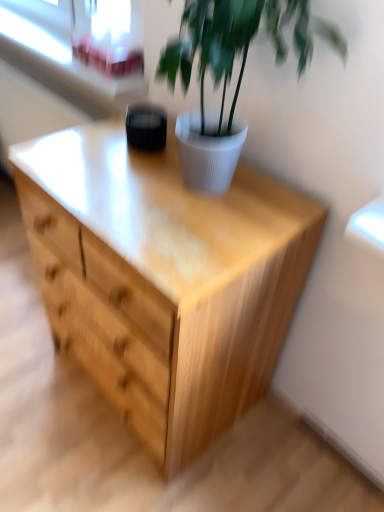
At what (x,y) coordinates should I click in order to perform the action: click on white plastic window frame at upper left. Please return your answer as a coordinate pair (x, y). This screenshot has width=384, height=512. Looking at the image, I should click on (81, 42).

Would you say white plastic window frame at upper left is inside or outside white ribbed pot at upper center?

white plastic window frame at upper left is outside white ribbed pot at upper center.

Considering their positions, is white plastic window frame at upper left located in front of or behind white ribbed pot at upper center?

Clearly, white plastic window frame at upper left is behind white ribbed pot at upper center.

Who is smaller, white plastic window frame at upper left or white ribbed pot at upper center?

Answer: Smaller between the two is white plastic window frame at upper left.

Does point (112, 4) come farther from viewer compared to point (254, 36)?

Yes.

Looking at this image, which is farther, (62, 33) or (98, 222)?

Point (62, 33)

Is white plastic window frame at upper left oriented away from natural wood chest of drawers at center?

No, natural wood chest of drawers at center is not at the back of white plastic window frame at upper left.

Which of these two, white plastic window frame at upper left or natural wood chest of drawers at center, stands taller?

With more height is natural wood chest of drawers at center.

Is white plastic window frame at upper left positioned behind natural wood chest of drawers at center?

Yes, white plastic window frame at upper left is further from the viewer.

Which object is further away from the camera, white ribbed pot at upper center or white plastic window frame at upper left?

white plastic window frame at upper left is further away from the camera.

Locate an element on the screen. The image size is (384, 512). houseplant that appears below the white plastic window frame at upper left (from the image's perspective) is located at coordinates (232, 66).

From a real-world perspective, is white ribbed pot at upper center physically located above or below white plastic window frame at upper left?

In terms of real-world spatial position, white ribbed pot at upper center is above white plastic window frame at upper left.

Considering the relative sizes of white ribbed pot at upper center and white plastic window frame at upper left in the image provided, is white ribbed pot at upper center bigger than white plastic window frame at upper left?

Yes.

Based on the photo, how many degrees apart are the facing directions of natural wood chest of drawers at center and transparent glass window screen at upper left?

The angular difference between natural wood chest of drawers at center and transparent glass window screen at upper left is 0.98 degrees.

How far apart are natural wood chest of drawers at center and transparent glass window screen at upper left?

A distance of 66.13 centimeters exists between natural wood chest of drawers at center and transparent glass window screen at upper left.

From the image's perspective, is natural wood chest of drawers at center positioned above or below transparent glass window screen at upper left?

Clearly, from the image's perspective, natural wood chest of drawers at center is below transparent glass window screen at upper left.

Is natural wood chest of drawers at center far from transparent glass window screen at upper left?

Actually, natural wood chest of drawers at center and transparent glass window screen at upper left are a little close together.

From the picture: Is the surface of white ribbed pot at upper center in direct contact with transparent glass window screen at upper left?

No.

From a real-world perspective, relative to transparent glass window screen at upper left, is white ribbed pot at upper center vertically above or below?

Clearly, from a real-world perspective, white ribbed pot at upper center is above transparent glass window screen at upper left.

Between point (200, 84) and point (137, 69), which one is positioned behind?

The point (137, 69) is farther from the camera.

From their relative heights in the image, would you say white ribbed pot at upper center is taller or shorter than transparent glass window screen at upper left?

Considering their sizes, white ribbed pot at upper center has more height than transparent glass window screen at upper left.

Considering the points (127, 44) and (202, 94), which point is in front, point (127, 44) or point (202, 94)?

The point (202, 94) is more forward.

Can you tell me how much transparent glass window screen at upper left and white ribbed pot at upper center differ in facing direction?

0.473 degrees separate the facing orientations of transparent glass window screen at upper left and white ribbed pot at upper center.

Can you confirm if transparent glass window screen at upper left is wider than white ribbed pot at upper center?

Incorrect, the width of transparent glass window screen at upper left does not surpass that of white ribbed pot at upper center.

From the image's perspective, between transparent glass window screen at upper left and natural wood chest of drawers at center, who is located below?

natural wood chest of drawers at center.

Between transparent glass window screen at upper left and natural wood chest of drawers at center, which one is positioned in front?

natural wood chest of drawers at center is closer to the camera.

Looking at this image, between transparent glass window screen at upper left and natural wood chest of drawers at center, which one has smaller size?

transparent glass window screen at upper left.

In the image, there is a white ribbed pot at upper center. Identify the location of window frame above it (from the image's perspective). (81, 42).

Image resolution: width=384 pixels, height=512 pixels. What are the coordinates of `the chest of drawers lying below the white plastic window frame at upper left (from the image's perspective)` in the screenshot? It's located at pos(164,279).

Consider the image. Considering their positions, is natural wood chest of drawers at center positioned closer to white ribbed pot at upper center than white plastic window frame at upper left?

Based on the image, natural wood chest of drawers at center appears to be nearer to white ribbed pot at upper center.

Which object lies further to the anchor point white ribbed pot at upper center, white plastic window frame at upper left or transparent glass window screen at upper left?

white plastic window frame at upper left.

Considering their positions, is transparent glass window screen at upper left positioned further to natural wood chest of drawers at center than white ribbed pot at upper center?

Based on the image, transparent glass window screen at upper left appears to be further to natural wood chest of drawers at center.

Looking at the image, which one is located further to natural wood chest of drawers at center, transparent glass window screen at upper left or white plastic window frame at upper left?

The object further to natural wood chest of drawers at center is transparent glass window screen at upper left.

Considering their positions, is transparent glass window screen at upper left positioned closer to white ribbed pot at upper center than white plastic window frame at upper left?

Based on the image, transparent glass window screen at upper left appears to be nearer to white ribbed pot at upper center.

When comparing their distances from natural wood chest of drawers at center, does white plastic window frame at upper left or transparent glass window screen at upper left seem closer?

white plastic window frame at upper left.

Based on their spatial positions, is natural wood chest of drawers at center or white ribbed pot at upper center closer to transparent glass window screen at upper left?

Among the two, white ribbed pot at upper center is located nearer to transparent glass window screen at upper left.

From the picture: When comparing their distances from white ribbed pot at upper center, does white plastic window frame at upper left or natural wood chest of drawers at center seem closer?

natural wood chest of drawers at center.

Identify the location of window screen between white plastic window frame at upper left and natural wood chest of drawers at center in the vertical direction. (110, 37).

This screenshot has width=384, height=512. Find the location of `houseplant between white plastic window frame at upper left and natural wood chest of drawers at center in the up-down direction`. houseplant between white plastic window frame at upper left and natural wood chest of drawers at center in the up-down direction is located at coordinates (232, 66).

This screenshot has width=384, height=512. I want to click on window screen located between white ribbed pot at upper center and white plastic window frame at upper left in the depth direction, so click(x=110, y=37).

This screenshot has height=512, width=384. I want to click on houseplant between transparent glass window screen at upper left and natural wood chest of drawers at center from top to bottom, so click(x=232, y=66).